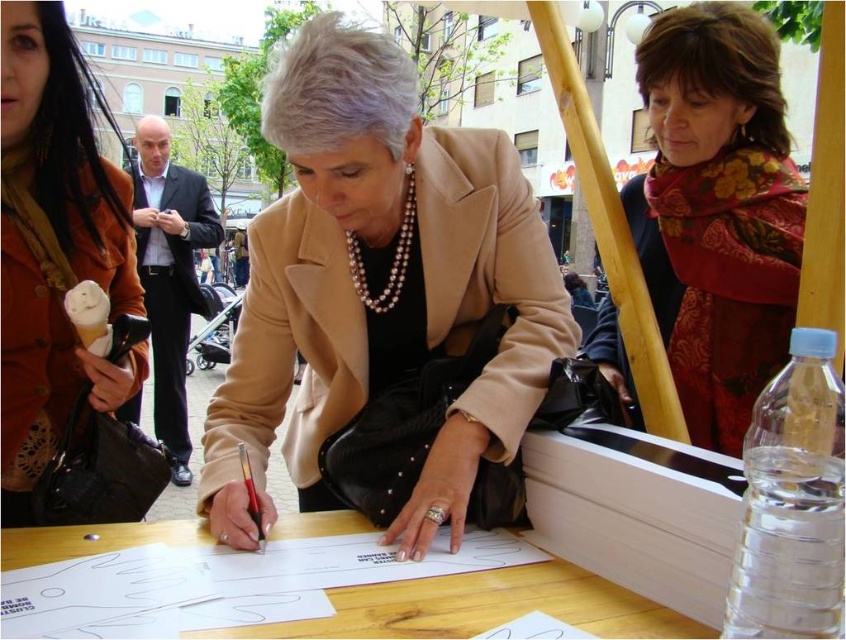
You are a photographer at the event and need to capture a clear shot of both the beige leather jacket at center and the metallic red pen at center. Since you want to ensure both are in focus, which object should you adjust your camera focus on first to account for their size difference?

The beige leather jacket at center is much taller than the metallic red pen at center, so you should focus on the beige leather jacket at center first as it is larger and requires more precise focus.

You are organizing a signing event and need to place a beige leather jacket at center and a metallic red pen at center on a small table. Considering their sizes, which item should be placed first to ensure both fit comfortably?

The metallic red pen at center should be placed first since it is smaller than the beige leather jacket at center, allowing enough space for both items on the table.